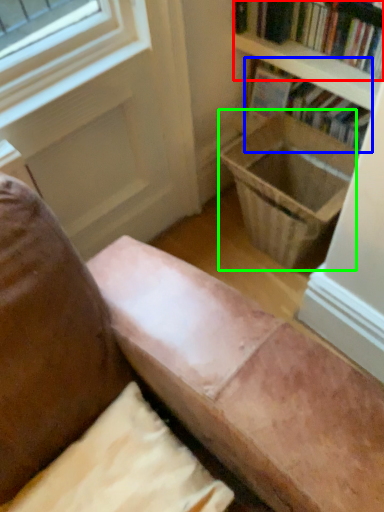
Question: Which is nearer to the book (highlighted by a red box)? book (highlighted by a blue box) or laundry basket (highlighted by a green box).

Choices:
 (A) book
 (B) laundry basket

Answer: (A)